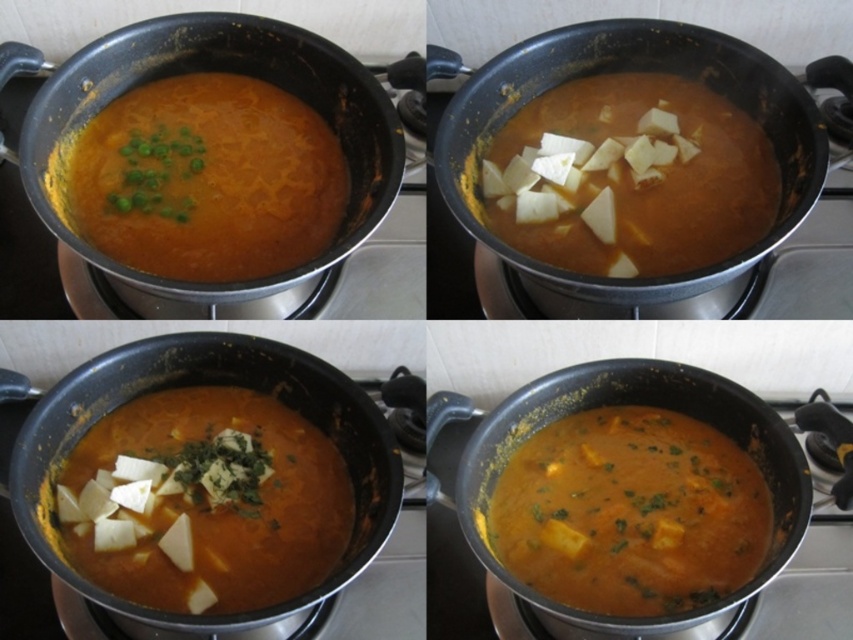
You are a food photographer standing 30 inches away from the camera. You want to take a closeup shot of the white crumbly tofu at center. Can you get a clear closeup shot of it without moving the camera?

The white crumbly tofu at center is 29.19 inches away from camera, so yes, you can get a clear closeup shot of it without moving the camera since it is within the 30 inches distance.